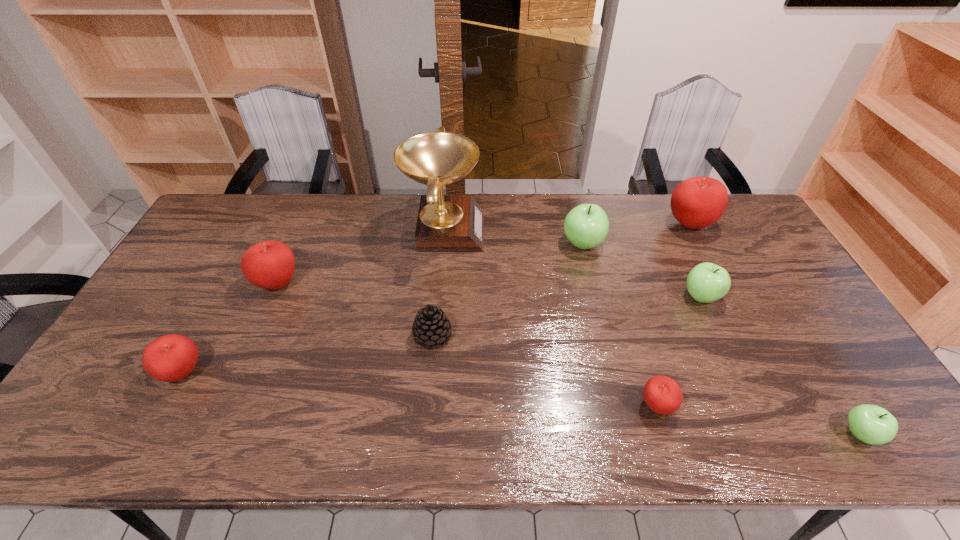
Locate an element on the screen. The width and height of the screenshot is (960, 540). vacant region located on the front of the second farthest green apple is located at coordinates (751, 404).

You are a GUI agent. You are given a task and a screenshot of the screen. Output one action in this format:
    pyautogui.click(x=<x>, y=<y>)
    Task: Click on the blank area located 0.270m at the narrow end of the pinecone
    This screenshot has height=540, width=960.
    Given the screenshot: What is the action you would take?
    pyautogui.click(x=551, y=336)

What are the coordinates of `free space located on the left of the smallest red apple` in the screenshot? It's located at (560, 406).

In order to click on free space located 0.360m on the back of the rightmost green apple in this screenshot , I will do `click(778, 301)`.

Locate an element on the screen. This screenshot has height=540, width=960. award situated at the far edge is located at coordinates (446, 223).

What are the coordinates of `object that is at the left edge` in the screenshot? It's located at (169, 358).

In order to click on object present at the far right corner in this screenshot , I will do `click(697, 202)`.

Image resolution: width=960 pixels, height=540 pixels. Find the location of `object that is at the near right corner`. object that is at the near right corner is located at coordinates (871, 424).

At what (x,y) coordinates should I click in order to perform the action: click on free region at the far edge of the desktop. Please return your answer as a coordinate pair (x, y). The height and width of the screenshot is (540, 960). Looking at the image, I should click on (396, 205).

Locate an element on the screen. vacant region at the near edge is located at coordinates (563, 447).